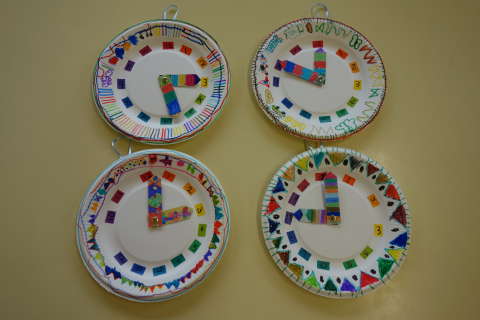
Find the location of a particular element. wall is located at coordinates (449, 133).